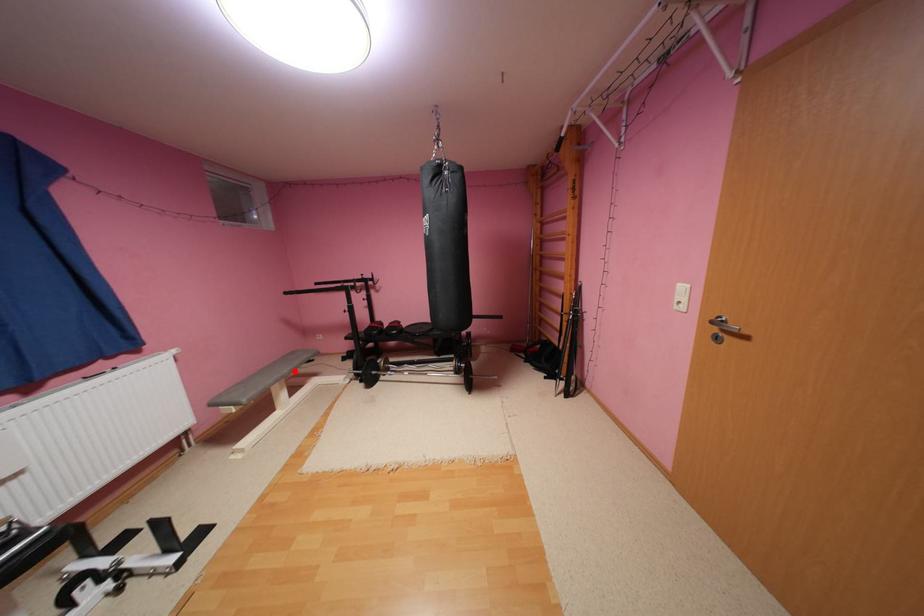
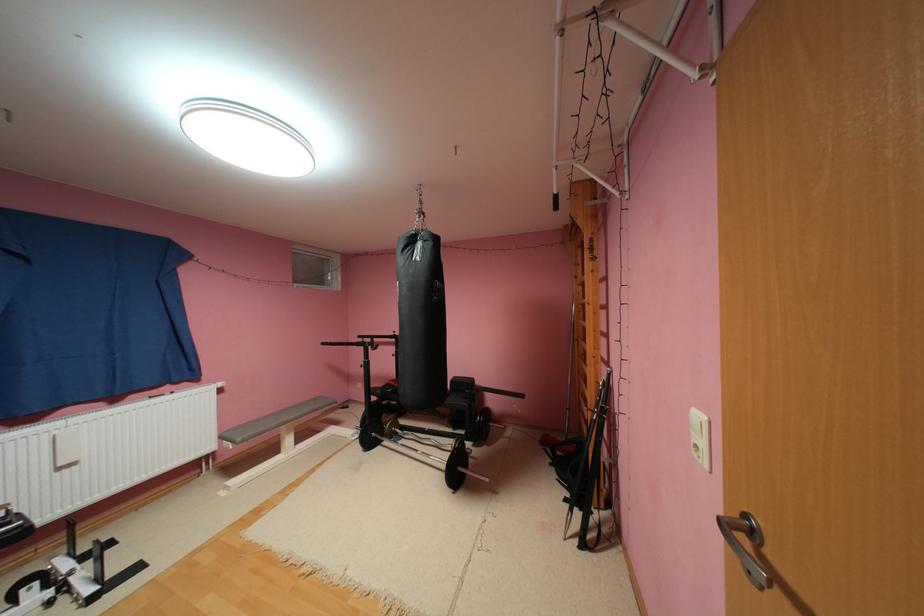
Locate, in the second image, the point that corresponds to the highlighted location in the first image.

(300, 416)